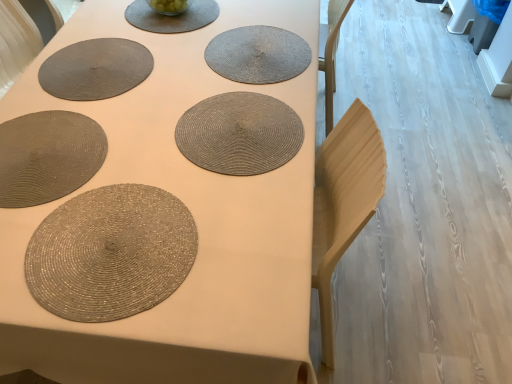
Image resolution: width=512 pixels, height=384 pixels. Find the location of `spots to the right of matte gray placemat at upper left, which appears as the 3th paper plate when viewed from the front`. spots to the right of matte gray placemat at upper left, which appears as the 3th paper plate when viewed from the front is located at coordinates (187, 62).